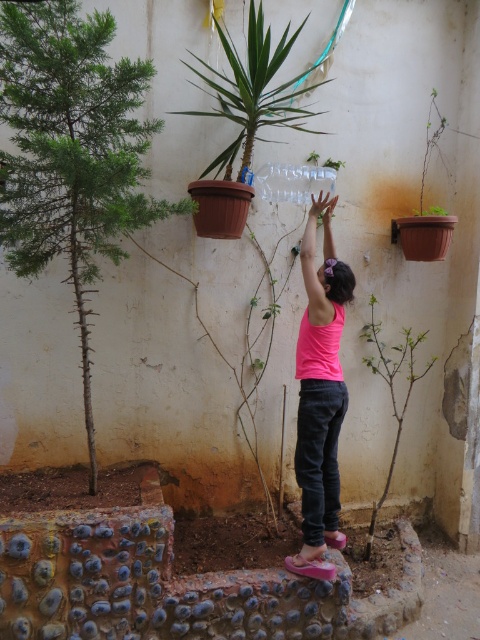
Question: Which object is closer to the camera taking this photo?

Choices:
 (A) green spiky tree at lower left
 (B) pink matte tank top at center

Answer: (A)

Question: Where is green spiky tree at lower left located in relation to pink matte tank top at center in the image?

Choices:
 (A) above
 (B) below

Answer: (A)

Question: Is green spiky tree at lower left smaller than pink matte tank top at center?

Choices:
 (A) no
 (B) yes

Answer: (A)

Question: Is green spiky tree at lower left positioned behind pink matte tank top at center?

Choices:
 (A) no
 (B) yes

Answer: (A)